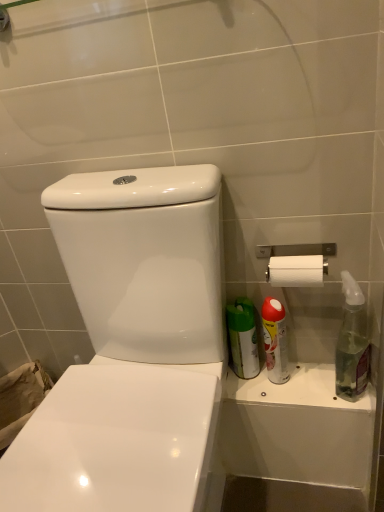
Question: From a real-world perspective, is silver metallic toilet paper holder at upper right located higher than white glossy toilet at center?

Choices:
 (A) yes
 (B) no

Answer: (A)

Question: Does silver metallic toilet paper holder at upper right touch white glossy toilet at center?

Choices:
 (A) no
 (B) yes

Answer: (A)

Question: Is silver metallic toilet paper holder at upper right facing away from white glossy toilet at center?

Choices:
 (A) no
 (B) yes

Answer: (A)

Question: Is silver metallic toilet paper holder at upper right thinner than white glossy toilet at center?

Choices:
 (A) yes
 (B) no

Answer: (A)

Question: Is silver metallic toilet paper holder at upper right behind white glossy toilet at center?

Choices:
 (A) no
 (B) yes

Answer: (B)

Question: Is silver metallic toilet paper holder at upper right in front of or behind red matte spray can at right, the second cleaning product in the right-to-left sequence, in the image?

Choices:
 (A) front
 (B) behind

Answer: (A)

Question: Considering the positions of silver metallic toilet paper holder at upper right and red matte spray can at right, positioned as the first cleaning product in left-to-right order, in the image, is silver metallic toilet paper holder at upper right bigger or smaller than red matte spray can at right, positioned as the first cleaning product in left-to-right order,?

Choices:
 (A) big
 (B) small

Answer: (A)

Question: Is silver metallic toilet paper holder at upper right taller or shorter than red matte spray can at right, the second cleaning product in the right-to-left sequence?

Choices:
 (A) tall
 (B) short

Answer: (B)

Question: From a real-world perspective, is silver metallic toilet paper holder at upper right positioned above or below red matte spray can at right, the second cleaning product in the right-to-left sequence?

Choices:
 (A) above
 (B) below

Answer: (A)

Question: Considering the positions of point (283, 332) and point (294, 249), is point (283, 332) closer or farther from the camera than point (294, 249)?

Choices:
 (A) closer
 (B) farther

Answer: (B)

Question: Considering their positions, is red matte spray can at right, positioned as the first cleaning product in left-to-right order, located in front of or behind silver metallic toilet paper holder at upper right?

Choices:
 (A) front
 (B) behind

Answer: (B)

Question: From the image's perspective, relative to silver metallic toilet paper holder at upper right, is red matte spray can at right, positioned as the first cleaning product in left-to-right order, above or below?

Choices:
 (A) below
 (B) above

Answer: (A)

Question: Looking at their shapes, would you say red matte spray can at right, the second cleaning product in the right-to-left sequence, is wider or thinner than silver metallic toilet paper holder at upper right?

Choices:
 (A) thin
 (B) wide

Answer: (A)

Question: Is clear glass spray bottle at right, positioned as the 1th cleaning product in right-to-left order, inside the boundaries of white glossy toilet at center, or outside?

Choices:
 (A) inside
 (B) outside

Answer: (B)

Question: Is clear glass spray bottle at right, positioned as the 1th cleaning product in right-to-left order, to the left or to the right of white glossy toilet at center in the image?

Choices:
 (A) left
 (B) right

Answer: (B)